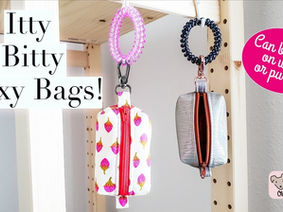
This screenshot has height=212, width=283. What are the coordinates of `tan wood leg` in the screenshot? It's located at (229, 195).